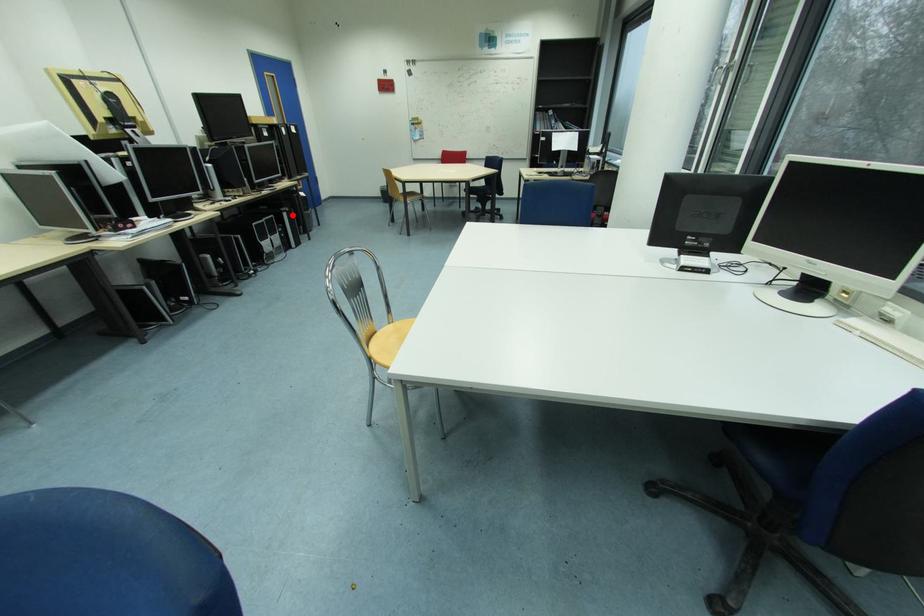
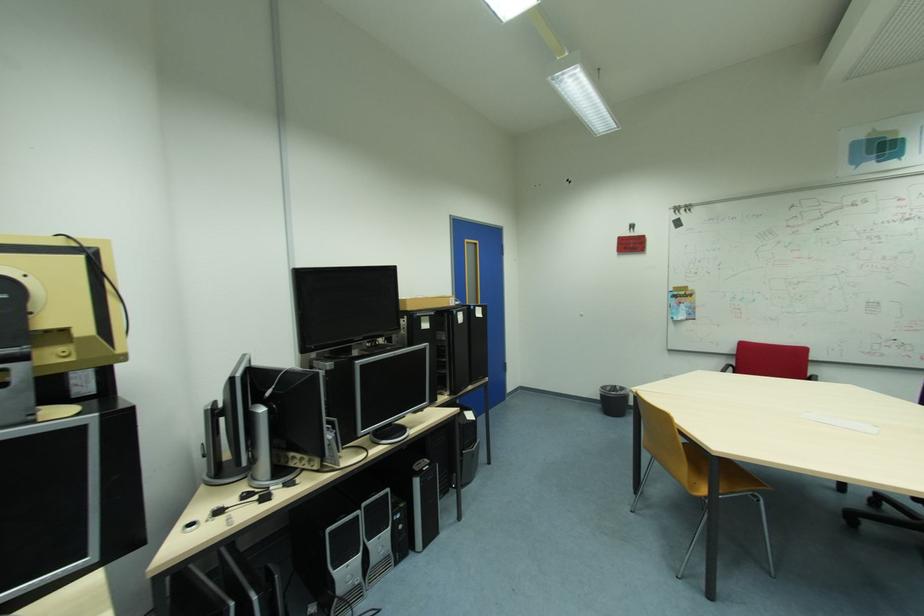
Question: A red point is marked in image1. In image2, is the corresponding 3D point closer to the camera or farther? Reply with the corresponding letter.

Choices:
 (A) The corresponding 3D point is closer.
 (B) The corresponding 3D point is farther.

Answer: (B)